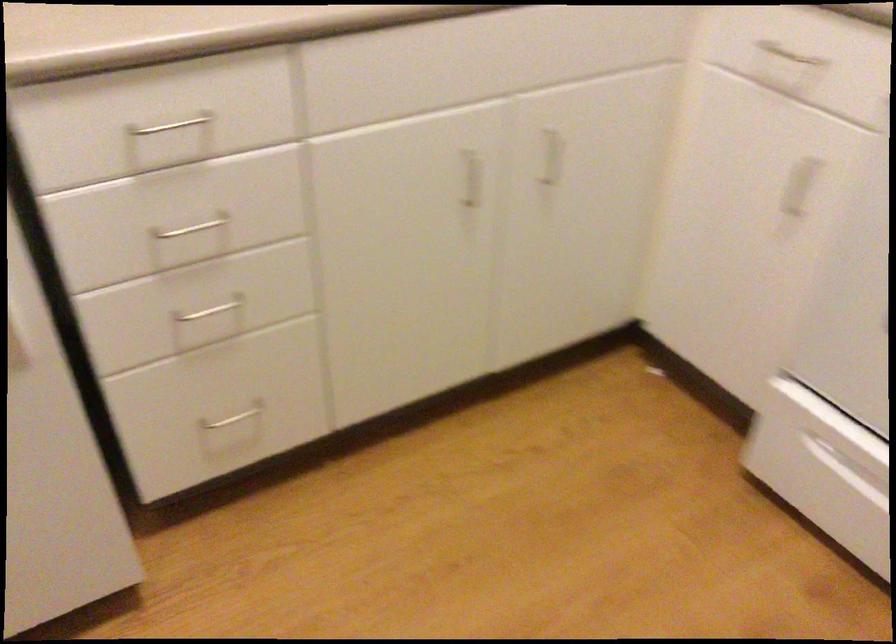
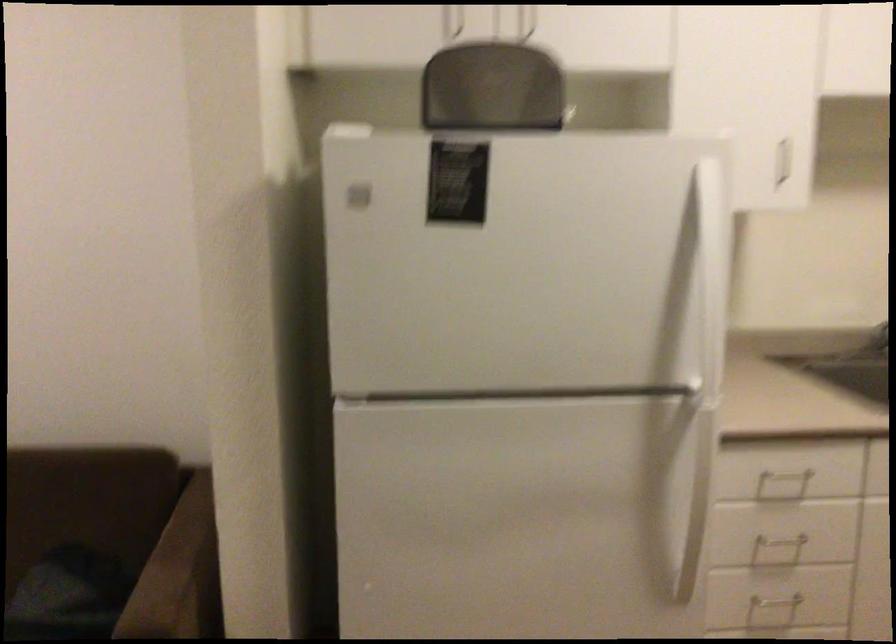
Locate, in the second image, the point that corresponds to point (168, 147) in the first image.

(780, 486)